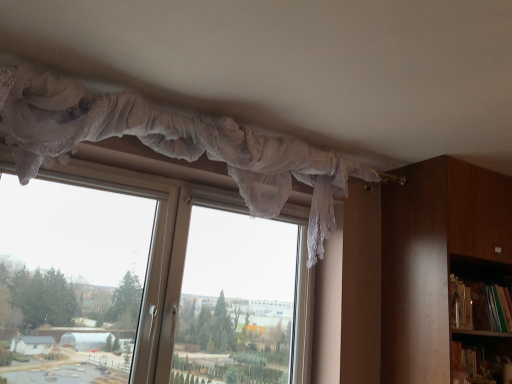
Question: Looking at their shapes, would you say green matte bookshelf at right is wider or thinner than transparent lace curtain at upper center?

Choices:
 (A) thin
 (B) wide

Answer: (A)

Question: Based on their positions, is green matte bookshelf at right located to the left or right of transparent lace curtain at upper center?

Choices:
 (A) right
 (B) left

Answer: (A)

Question: Which of these objects is positioned closest to the transparent lace curtain at upper center?

Choices:
 (A) green matte bookshelf at right
 (B) white lace curtain at upper center
 (C) brown wooden bookcase at right

Answer: (B)

Question: Estimate the real-world distances between objects in this image. Which object is farther from the transparent lace curtain at upper center?

Choices:
 (A) green matte bookshelf at right
 (B) white lace curtain at upper center
 (C) brown wooden bookcase at right

Answer: (A)